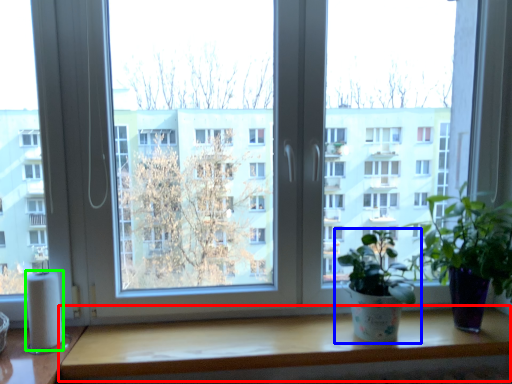
Question: Which is farther away from table (highlighted by a red box)? houseplant (highlighted by a blue box) or toilet paper (highlighted by a green box)?

Choices:
 (A) houseplant
 (B) toilet paper

Answer: (B)